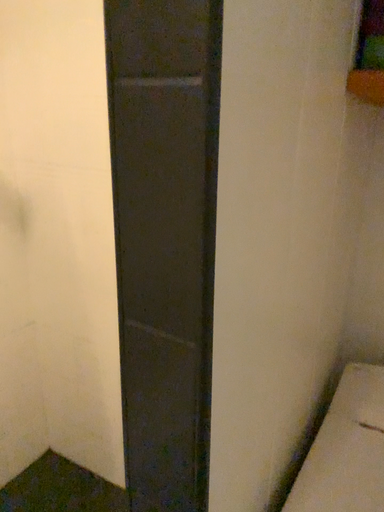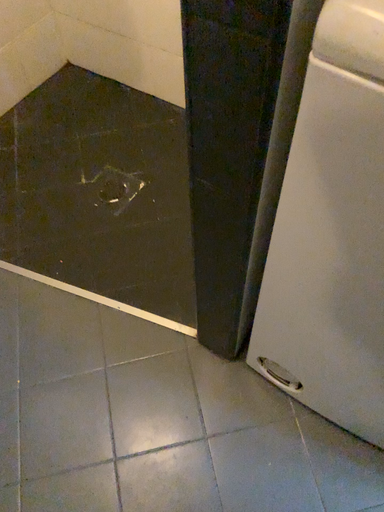
Question: How did the camera likely rotate when shooting the video?

Choices:
 (A) rotated downward
 (B) rotated upward

Answer: (A)